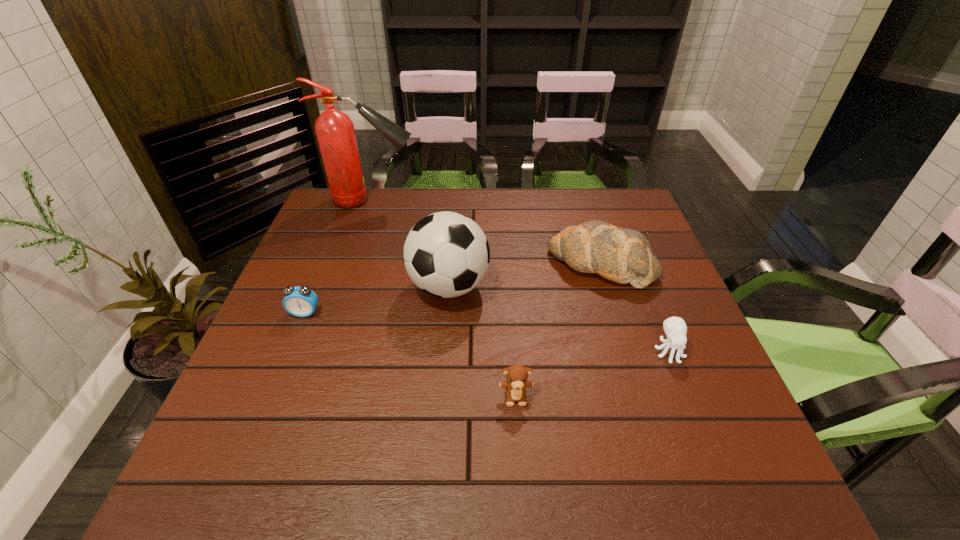
I want to click on vacant area that lies between the fourth shortest object and the second nearest object, so (x=636, y=307).

Locate an element on the screen. The width and height of the screenshot is (960, 540). empty space that is in between the nearest object and the alarm clock is located at coordinates (410, 354).

The height and width of the screenshot is (540, 960). In order to click on vacant area that lies between the nearest object and the alarm clock in this screenshot , I will do `click(410, 354)`.

Locate an element on the screen. empty space that is in between the teddy bear and the soccer ball is located at coordinates (482, 341).

This screenshot has width=960, height=540. Identify the location of free space between the fourth object from left to right and the fourth shortest object. (559, 330).

The width and height of the screenshot is (960, 540). What are the coordinates of `object that is the fourth closest to the fire extinguisher` in the screenshot? It's located at (516, 384).

What are the coordinates of `object that stands as the second closest to the fifth shortest object` in the screenshot? It's located at (516, 384).

Find the location of `blank area in the image that satisfies the following two spatial constraints: 1. at the nozzle end of the fire extinguisher; 2. on the face of the alarm clock`. blank area in the image that satisfies the following two spatial constraints: 1. at the nozzle end of the fire extinguisher; 2. on the face of the alarm clock is located at coordinates (x=334, y=313).

Image resolution: width=960 pixels, height=540 pixels. I want to click on free spot that satisfies the following two spatial constraints: 1. at the nozzle end of the fire extinguisher; 2. on the left side of the bread, so click(350, 264).

The image size is (960, 540). I want to click on vacant space that satisfies the following two spatial constraints: 1. at the nozzle end of the fire extinguisher; 2. on the back side of the fourth object from right to left, so click(x=343, y=286).